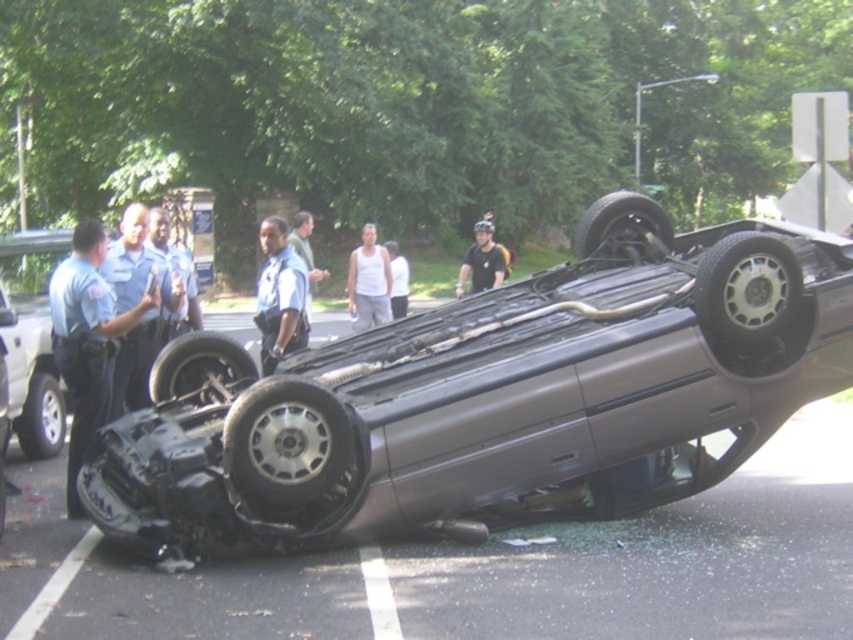
You are a pedestrian standing at the point marked by coordinates point (86, 340). You want to cross the road to reach the other side. The road is busy with traffic. Which direction should you walk to find a safe crossing point near the dark blue uniform at left?

The point (86, 340) is located on the dark blue uniform at left, so you are already at the dark blue uniform at left. Therefore, you should look for a safe crossing point in the vicinity of the dark blue uniform at left.